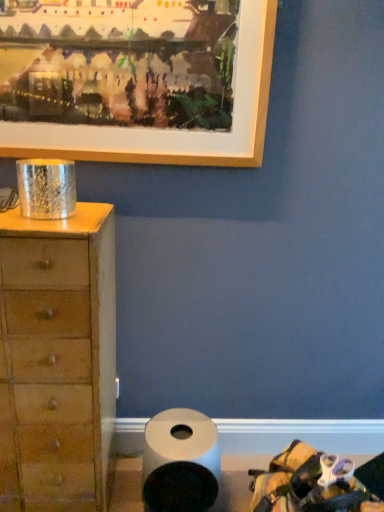
Question: Should I look upward or downward to see white matte toilet paper at lower center?

Choices:
 (A) down
 (B) up

Answer: (A)